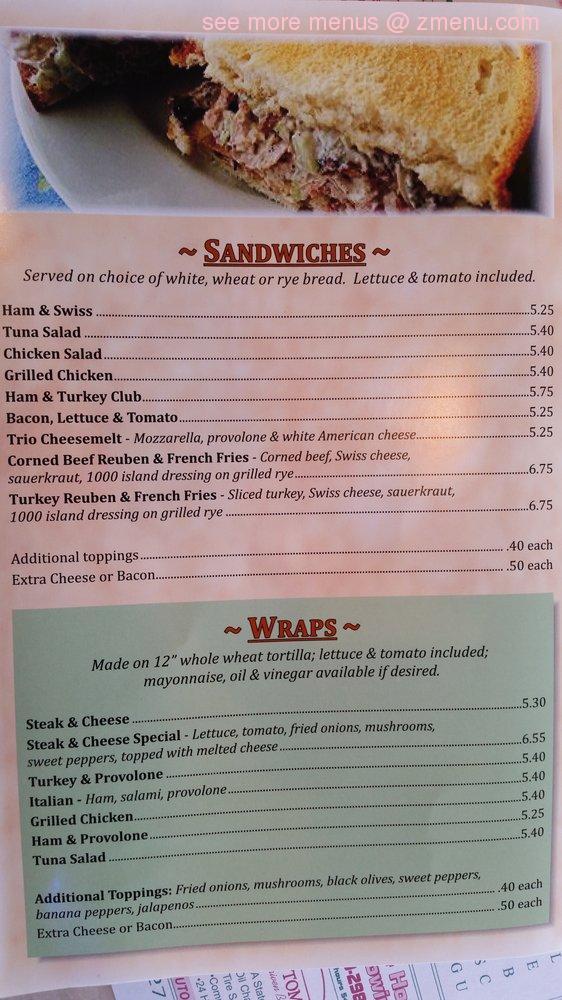
This screenshot has width=562, height=1000. In order to click on table in this screenshot , I will do `click(103, 992)`.